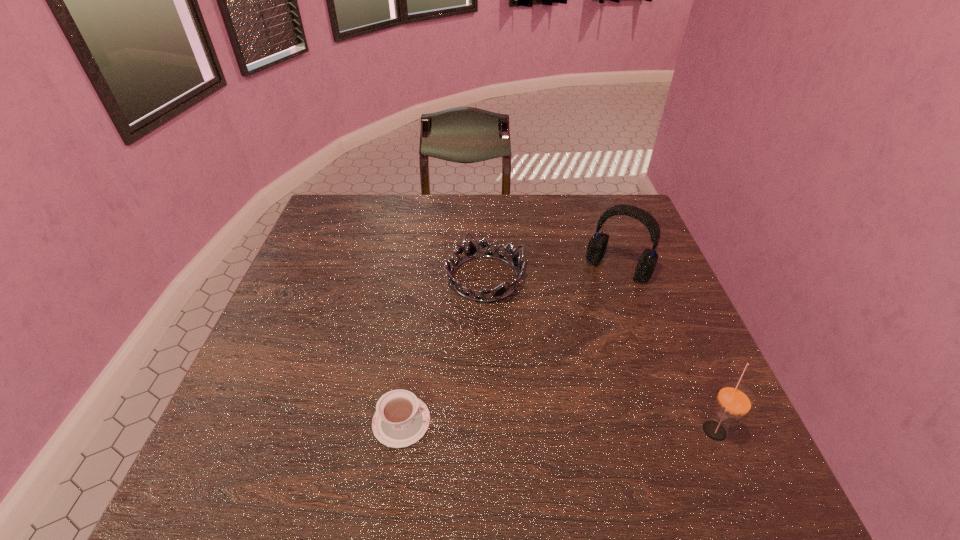
The width and height of the screenshot is (960, 540). Identify the location of free region located 0.330m on the headband of the headset. (549, 367).

Identify the location of vacant area located 0.260m on the front-facing side of the second object from left to right. (556, 381).

Where is `vacant space located on the front-facing side of the second object from left to right`? vacant space located on the front-facing side of the second object from left to right is located at coordinates (561, 388).

Find the location of a particular element. free space located on the front-facing side of the second object from left to right is located at coordinates (551, 374).

The height and width of the screenshot is (540, 960). What are the coordinates of `teacup that is at the near edge` in the screenshot? It's located at (401, 419).

At what (x,y) coordinates should I click in order to perform the action: click on straw that is positioned at the near edge. Please return your answer as a coordinate pair (x, y). This screenshot has height=540, width=960. Looking at the image, I should click on (734, 400).

You are a GUI agent. You are given a task and a screenshot of the screen. Output one action in this format:
    pyautogui.click(x=<x>, y=<y>)
    Task: Click on the straw located in the right edge section of the desktop
    Image resolution: width=960 pixels, height=540 pixels.
    Given the screenshot: What is the action you would take?
    pyautogui.click(x=734, y=400)

Identify the location of headset that is positioned at the right edge. (597, 245).

Where is `object positioned at the near right corner`? object positioned at the near right corner is located at coordinates (734, 400).

In the image, there is a desktop. Find the location of `free space at the far edge`. free space at the far edge is located at coordinates (459, 222).